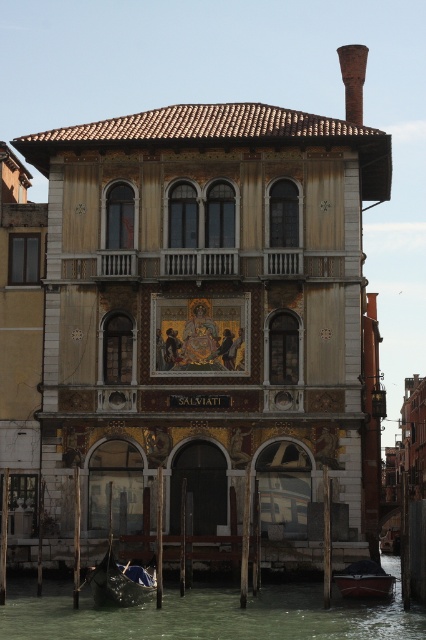
Question: Can you confirm if greenish water at lower center is positioned to the left of dark blue wooden boat at lower center?

Choices:
 (A) no
 (B) yes

Answer: (B)

Question: Which is farther from the dark blue polished wood gondola at lower left?

Choices:
 (A) dark blue wooden boat at lower center
 (B) greenish water at lower center

Answer: (A)

Question: Observing the image, what is the correct spatial positioning of greenish water at lower center in reference to dark blue polished wood gondola at lower left?

Choices:
 (A) below
 (B) above

Answer: (A)

Question: Does greenish water at lower center appear on the left side of dark blue polished wood gondola at lower left?

Choices:
 (A) no
 (B) yes

Answer: (A)

Question: Based on their relative distances, which object is nearer to the dark blue polished wood gondola at lower left?

Choices:
 (A) greenish water at lower center
 (B) dark blue wooden boat at lower center

Answer: (A)

Question: Among these objects, which one is nearest to the camera?

Choices:
 (A) greenish water at lower center
 (B) dark blue wooden boat at lower center

Answer: (A)